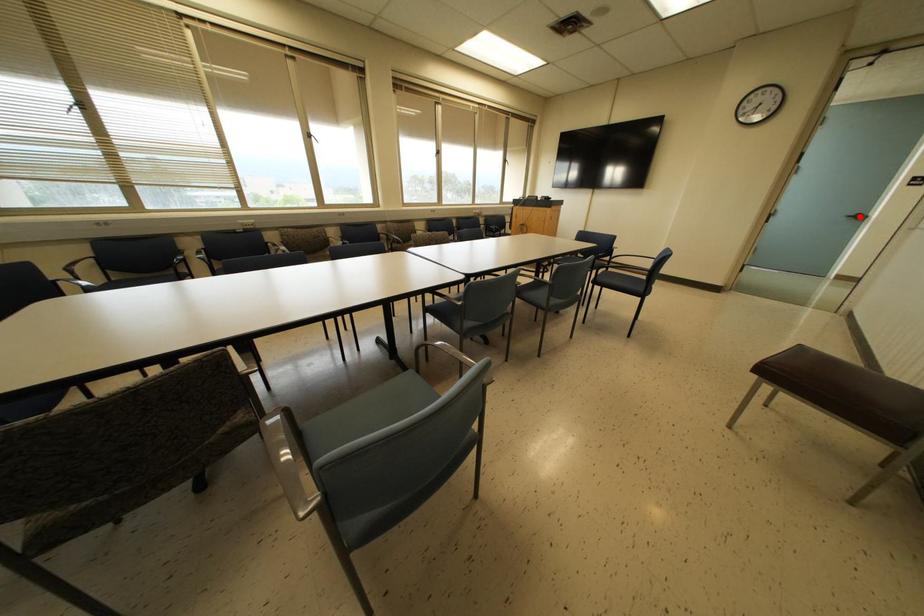
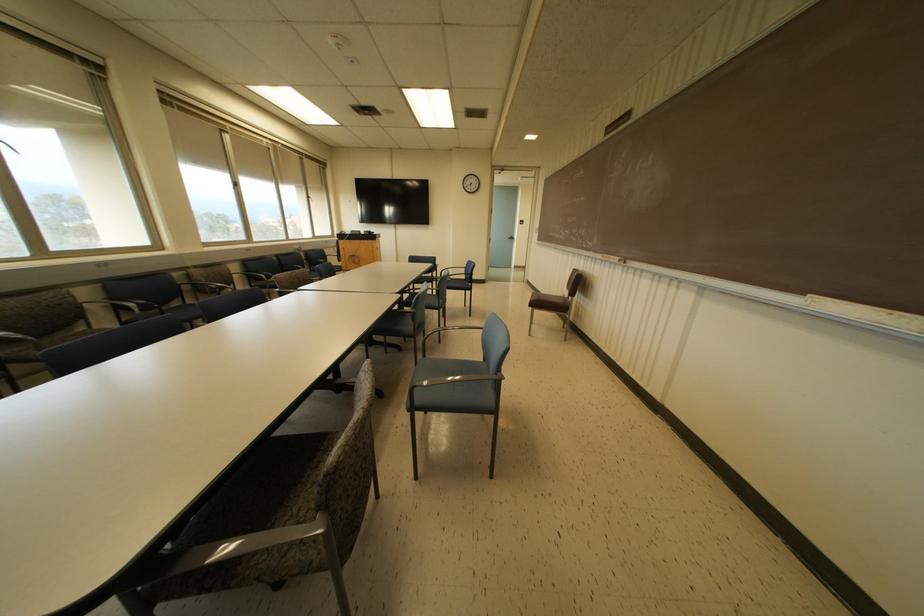
Question: I am providing you with two images of the same scene from different viewpoints. A red point is shown in image1. For the corresponding object point in image2, is it positioned nearer or farther from the camera?

Choices:
 (A) Nearer
 (B) Farther

Answer: (A)